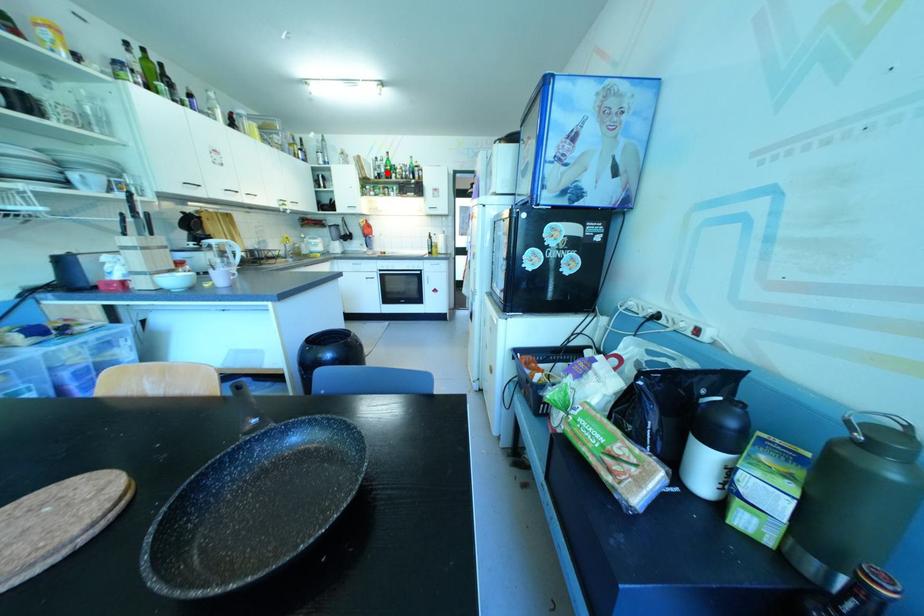
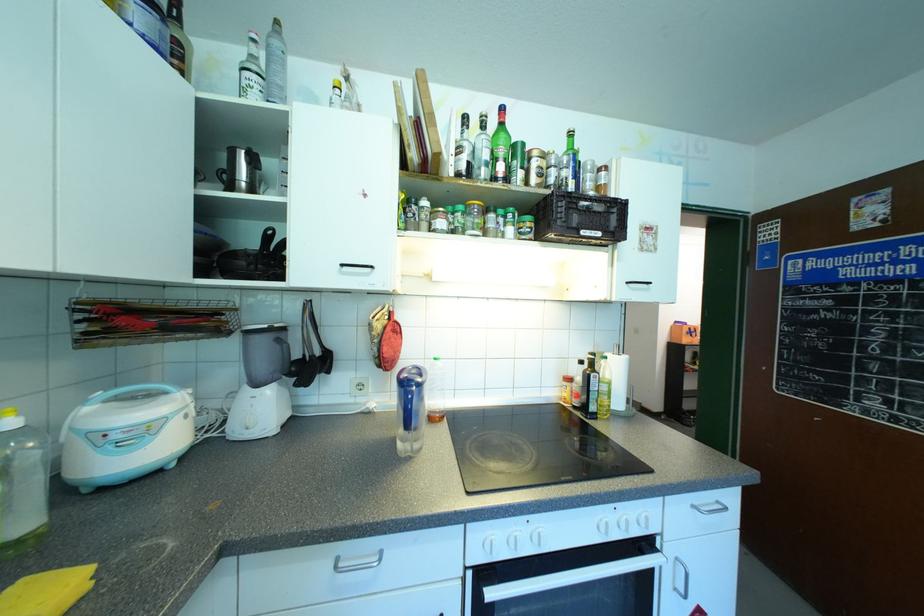
Where in the second image is the point corresponding to the highlighted location from the first image?

(500, 167)